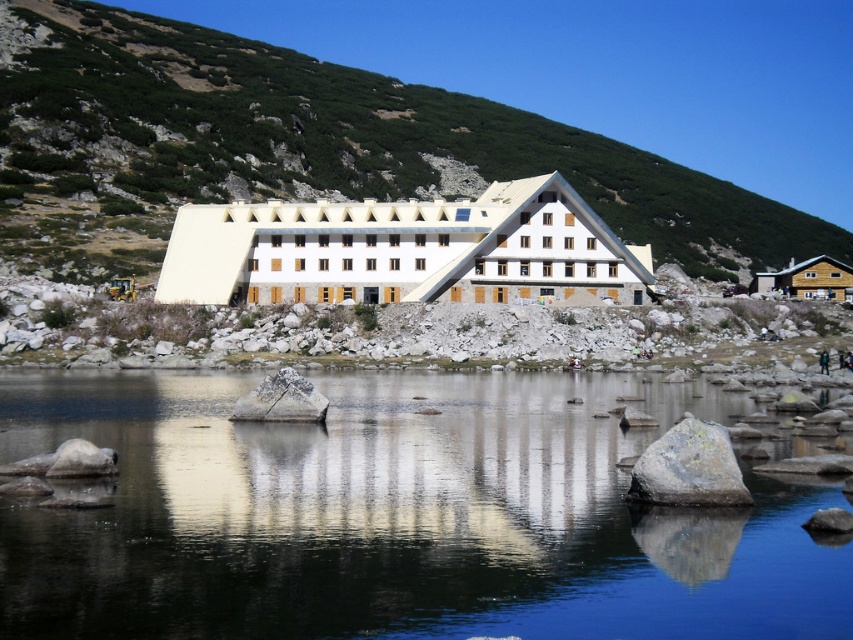
You are standing in front of the white stone building at center and want to reach the green grassy hillside at center. Which direction should you move to get there?

The green grassy hillside at center is above the white stone building at center, so you should move upward to reach it.

You are a landscape architect reviewing this design. The transparent water at center and green grassy hillside at center are both part of the project. Which of these two elements has a narrower width in the design?

The transparent water at center is thinner than the green grassy hillside at center, so the transparent water at center has a narrower width in the design.

You are standing at the edge of the water and want to walk to the white stone building at center and the wooden cabin at right. Which one is closer to you?

The wooden cabin at right is closer to you because the white stone building at center is located above it, meaning the cabin is positioned lower in elevation.